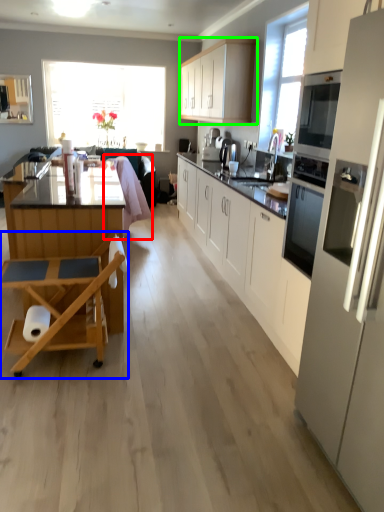
Question: Considering the real-world distances, which object is closest to swivel chair (highlighted by a red box)? table (highlighted by a blue box) or cabinetry (highlighted by a green box).

Choices:
 (A) table
 (B) cabinetry

Answer: (B)